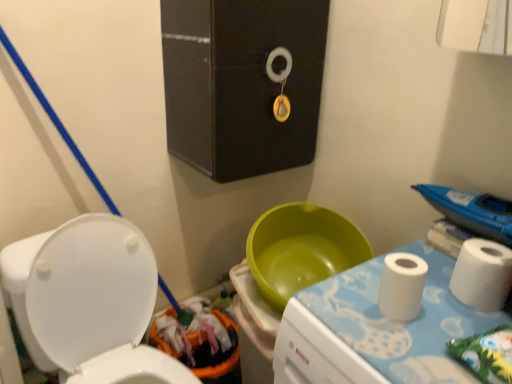
Identify the location of vacant region above white fabric changing table at right (from a real-world perspective). This screenshot has width=512, height=384. (409, 320).